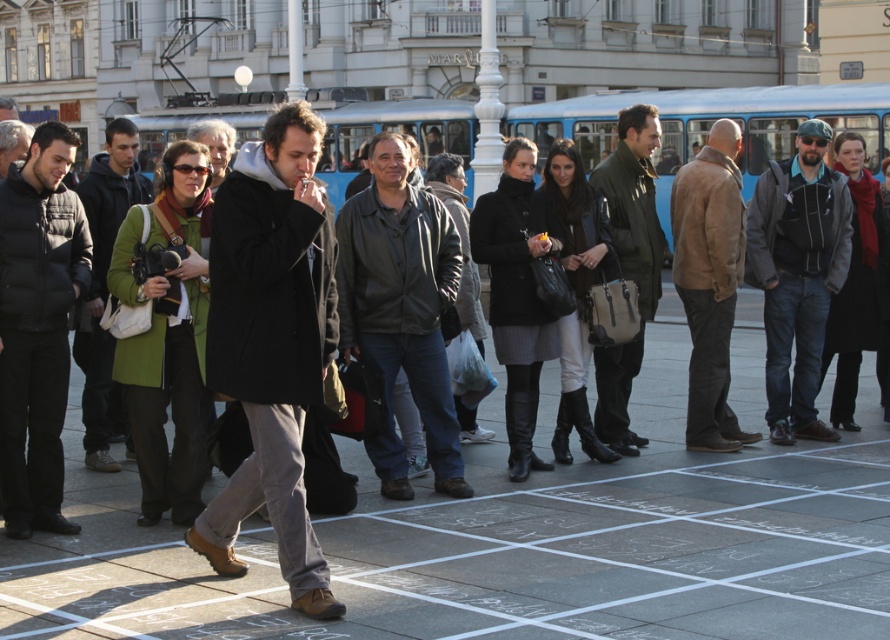
You are a photographer in the square and want to take a photo of the green wool coat at center and the matte black coat at center. Which one is positioned to the right side of the other?

The green wool coat at center is to the right of the matte black coat at center.

Looking at this image, you are standing in the plaza and see the point marked at coordinates (168, 340). What object is this point located on?

The point marked at coordinates (168, 340) is located on the green wool coat at center.

You are a fashion designer observing a group of people in an urban plaza. You notice two coats in the crowd. The first is a green wool coat at center, and the second is a matte black coat at center. Which coat is shorter?

The green wool coat at center is shorter than the matte black coat at center.